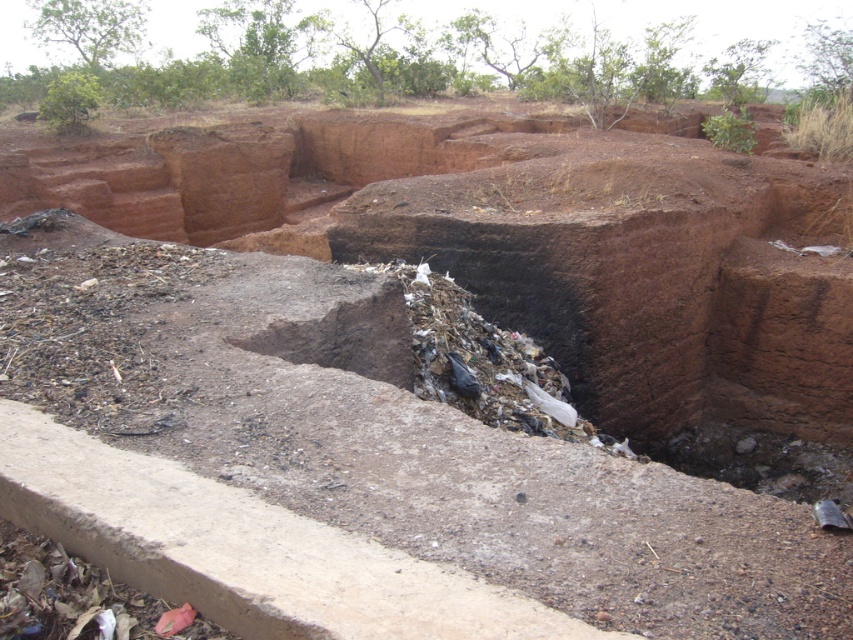
You are a waste management worker who needs to place a new trash bin on the ledge. The trash bin is the same size as the dark brown dirt at lower right. Can you fit the trash bin on the ledge without overlapping the black plastic bags at center?

The black plastic bags at center are larger in size than the dark brown dirt at lower right. Since the trash bin is the same size as the dark brown dirt, it may fit on the ledge, but you need to ensure there is enough space between the trash bin and the black plastic bags at center to avoid overlapping.